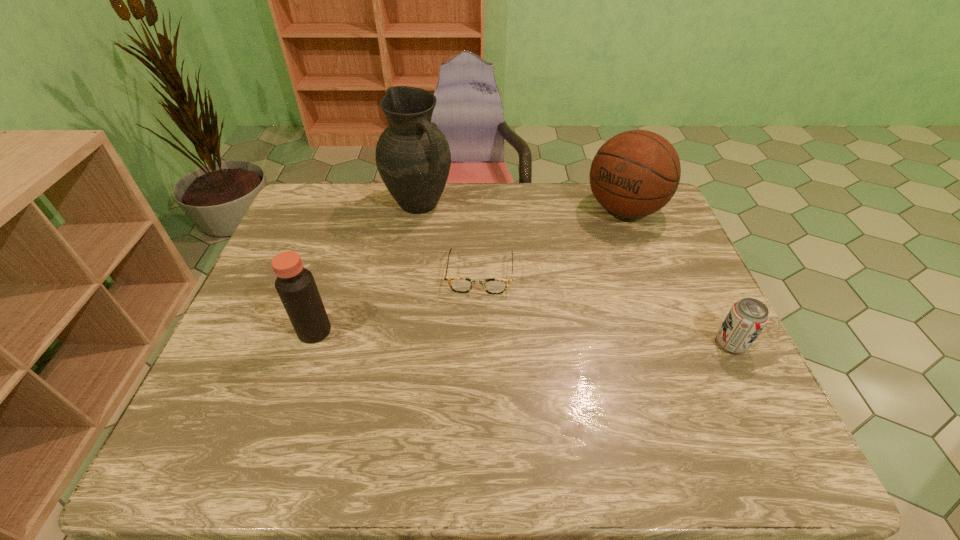
The image size is (960, 540). In order to click on the leftmost object in this screenshot , I will do `click(295, 285)`.

Locate an element on the screen. beer can is located at coordinates (746, 319).

This screenshot has width=960, height=540. Identify the location of the tallest object. (413, 158).

You are a GUI agent. You are given a task and a screenshot of the screen. Output one action in this format:
    pyautogui.click(x=<x>, y=<y>)
    Task: Click on the spectacles
    The image size is (960, 540).
    Given the screenshot: What is the action you would take?
    pyautogui.click(x=495, y=286)

Image resolution: width=960 pixels, height=540 pixels. I want to click on the third nearest object, so click(495, 286).

Find the location of `basketball`. basketball is located at coordinates (635, 173).

The height and width of the screenshot is (540, 960). Identify the location of vacant space located 0.050m on the back of the leftmost object. (324, 304).

This screenshot has height=540, width=960. Find the location of `vacant area situated 0.140m on the front of the second shortest object`. vacant area situated 0.140m on the front of the second shortest object is located at coordinates (764, 411).

The height and width of the screenshot is (540, 960). I want to click on vacant space located on the side of the pitcher with the handle, so click(489, 267).

The width and height of the screenshot is (960, 540). What are the coordinates of `vacant space located on the side of the pitcher with the handle` in the screenshot? It's located at (446, 228).